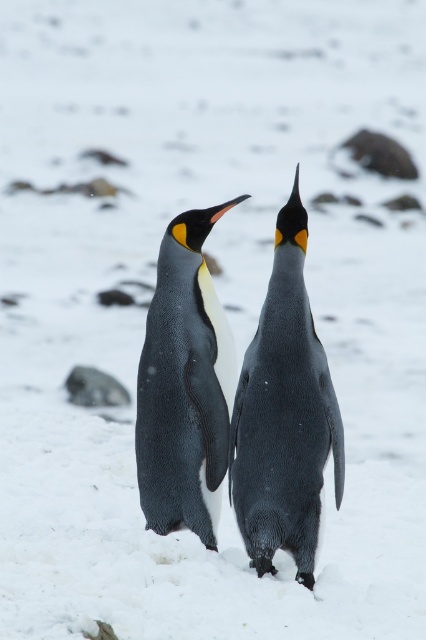
Question: Which point is closer to the camera taking this photo?

Choices:
 (A) (204, 216)
 (B) (276, 474)

Answer: (B)

Question: In this image, where is black matte penguin at center located relative to black glossy penguin at center?

Choices:
 (A) left
 (B) right

Answer: (B)

Question: Does black matte penguin at center appear on the left side of black glossy penguin at center?

Choices:
 (A) no
 (B) yes

Answer: (A)

Question: Which point is farther to the camera?

Choices:
 (A) black matte penguin at center
 (B) black glossy penguin at center

Answer: (B)

Question: From the image, what is the correct spatial relationship of black matte penguin at center in relation to black glossy penguin at center?

Choices:
 (A) below
 (B) above

Answer: (A)